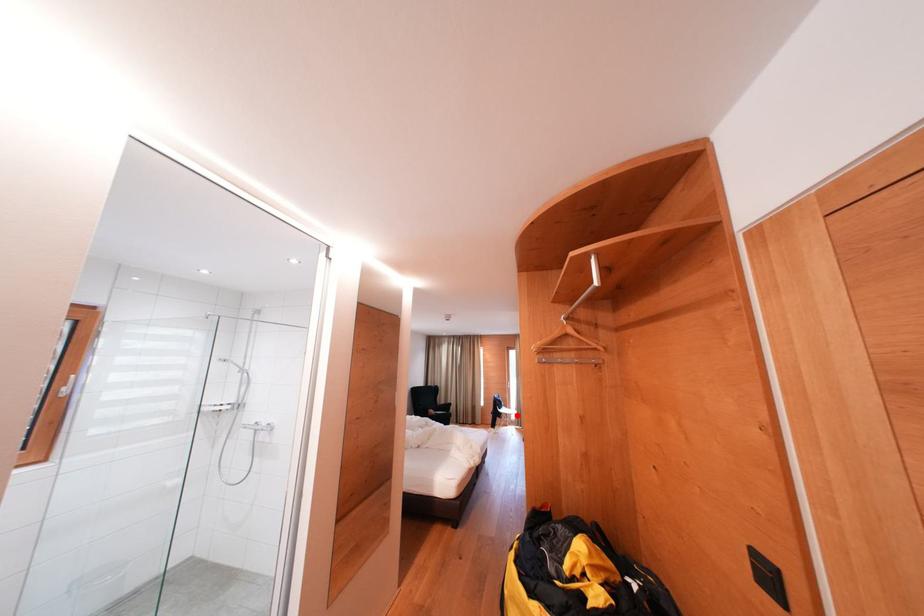
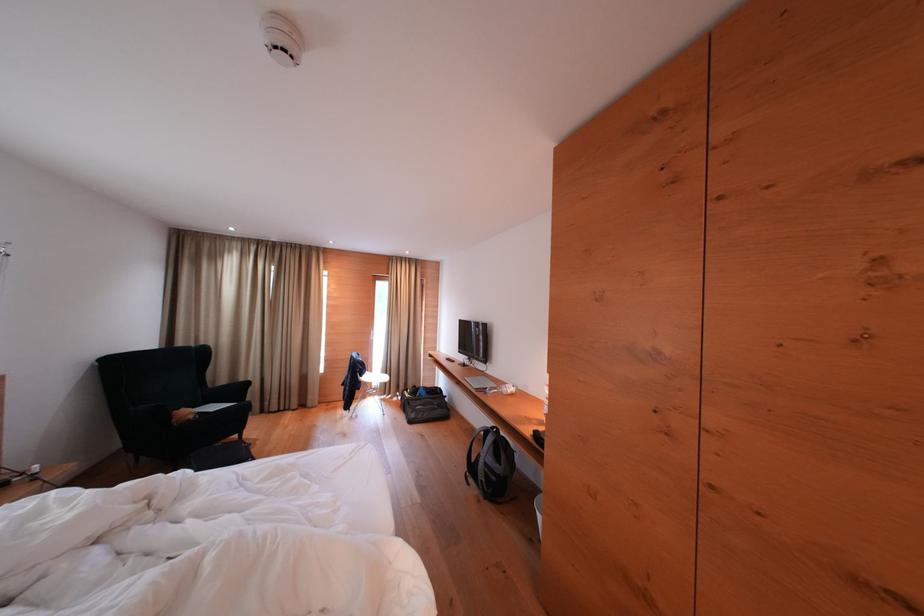
Question: I am providing you with two images of the same scene from different viewpoints. In image1, a red point is highlighted. Considering the same 3D point in image2, which of the following is correct?

Choices:
 (A) It is closer
 (B) It is farther

Answer: (A)